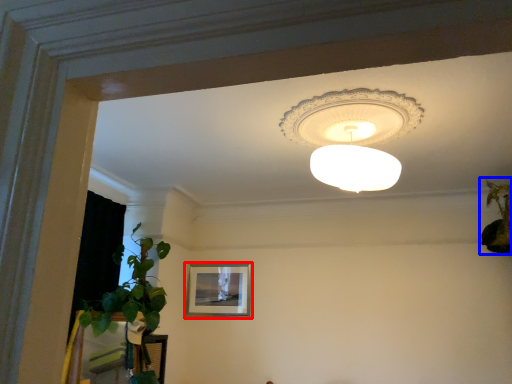
Question: Which point is closer to the camera, picture frame (highlighted by a red box) or houseplant (highlighted by a blue box)?

Choices:
 (A) picture frame
 (B) houseplant

Answer: (B)